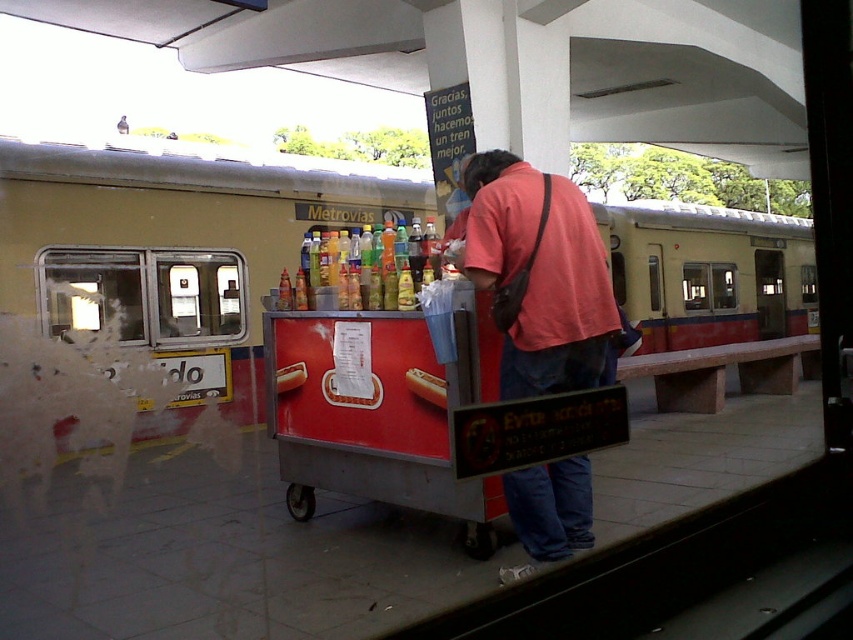
Locate an element on the screen. This screenshot has width=853, height=640. translucent plastic bottles at center is located at coordinates (355, 269).

Between point (320, 257) and point (300, 364), which one is positioned in front?

Positioned in front is point (300, 364).

Identify the location of translucent plastic bottles at center. click(x=355, y=269).

In order to click on translucent plastic bottles at center in this screenshot , I will do `click(355, 269)`.

Between matte pink shirt at center and smooth white hot dog at center, which one is positioned lower?

Positioned lower is smooth white hot dog at center.

Does matte pink shirt at center have a lesser width compared to smooth white hot dog at center?

Incorrect, matte pink shirt at center's width is not less than smooth white hot dog at center's.

Identify the location of matte pink shirt at center. This screenshot has height=640, width=853. (538, 275).

Does matte pink shirt at center appear under translucent plastic bottles at center?

No, matte pink shirt at center is not below translucent plastic bottles at center.

Describe the element at coordinates (538, 275) in the screenshot. The height and width of the screenshot is (640, 853). I see `matte pink shirt at center` at that location.

The height and width of the screenshot is (640, 853). I want to click on matte pink shirt at center, so pyautogui.click(x=538, y=275).